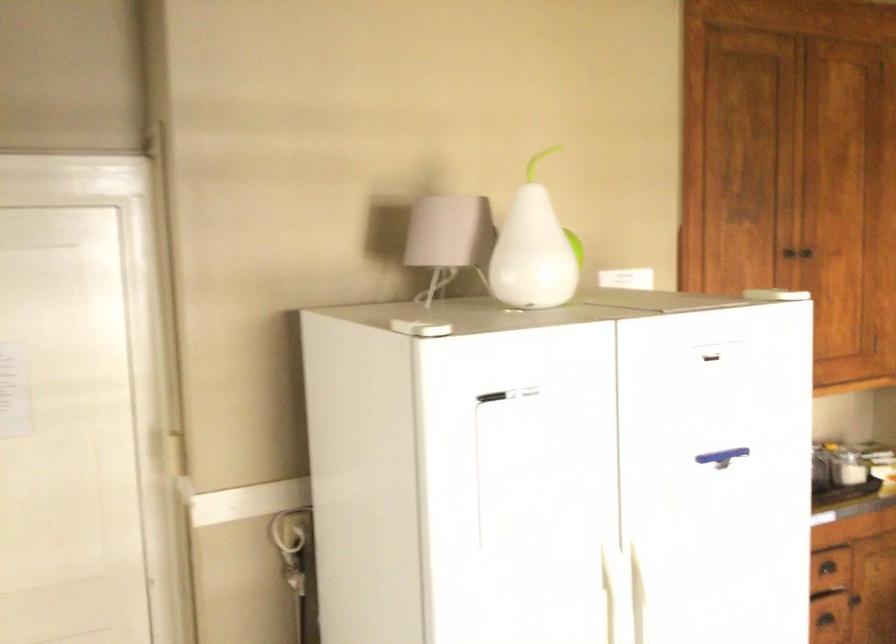
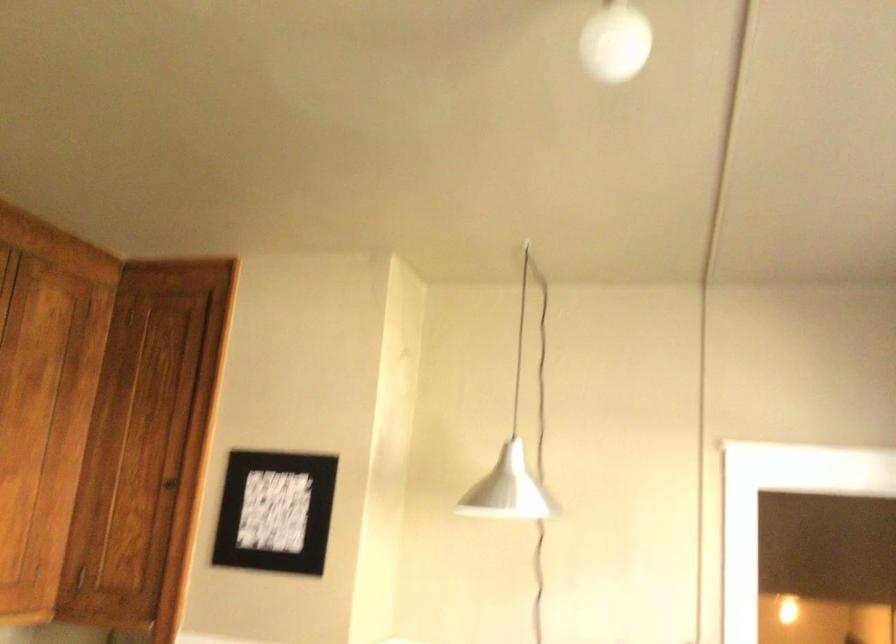
The images are taken continuously from a first-person perspective. In which direction is your viewpoint rotating?

The rotation direction of the camera is right-up.